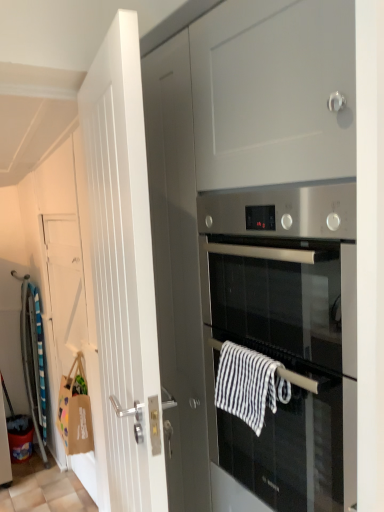
Question: Is white wooden door at left, the second door viewed from the back, at the right side of black and white striped towel at center, positioned as the 1th hand towel in right-to-left order?

Choices:
 (A) yes
 (B) no

Answer: (B)

Question: Considering the relative sizes of white wooden door at left, placed as the 2th door when sorted from left to right, and black and white striped towel at center, the first hand towel when ordered from top to bottom, in the image provided, is white wooden door at left, placed as the 2th door when sorted from left to right, taller than black and white striped towel at center, the first hand towel when ordered from top to bottom,?

Choices:
 (A) no
 (B) yes

Answer: (B)

Question: Is white wooden door at left, acting as the 1th door starting from the front, directly adjacent to black and white striped towel at center, placed as the second hand towel when sorted from left to right?

Choices:
 (A) yes
 (B) no

Answer: (B)

Question: Is white wooden door at left, placed as the 2th door when sorted from left to right, behind black and white striped towel at center, placed as the second hand towel when sorted from left to right?

Choices:
 (A) yes
 (B) no

Answer: (B)

Question: Is black and white striped towel at center, the first hand towel when ordered from top to bottom, at the back of white wooden door at left, acting as the 1th door starting from the front?

Choices:
 (A) no
 (B) yes

Answer: (B)

Question: Is white wooden door at left, placed as the 2th door when sorted from left to right, in front of black and white striped towel at center, the first hand towel when ordered from top to bottom?

Choices:
 (A) no
 (B) yes

Answer: (B)

Question: Can you confirm if stainless steel oven at center is taller than white wooden door at left, the 1th door viewed from the right?

Choices:
 (A) yes
 (B) no

Answer: (B)

Question: Can we say stainless steel oven at center lies outside white wooden door at left, the second door viewed from the back?

Choices:
 (A) no
 (B) yes

Answer: (B)

Question: Would you say stainless steel oven at center is a long distance from white wooden door at left, the second door viewed from the back?

Choices:
 (A) no
 (B) yes

Answer: (A)

Question: From the image's perspective, is stainless steel oven at center located above white wooden door at left, the 1th door viewed from the right?

Choices:
 (A) yes
 (B) no

Answer: (A)

Question: From a real-world perspective, is stainless steel oven at center beneath white wooden door at left, acting as the 1th door starting from the front?

Choices:
 (A) no
 (B) yes

Answer: (A)

Question: Does stainless steel oven at center turn towards white wooden door at left, the 1th door viewed from the right?

Choices:
 (A) no
 (B) yes

Answer: (A)

Question: Does striped cotton hand towel at left, which appears as the first hand towel when viewed from the left, have a lesser width compared to white wooden door at left, the 1th door viewed from the right?

Choices:
 (A) no
 (B) yes

Answer: (A)